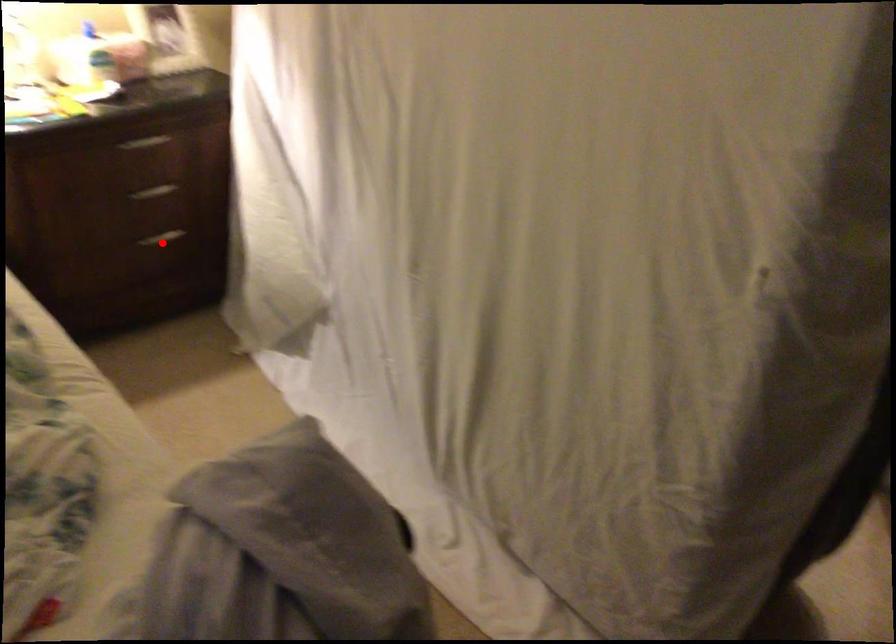
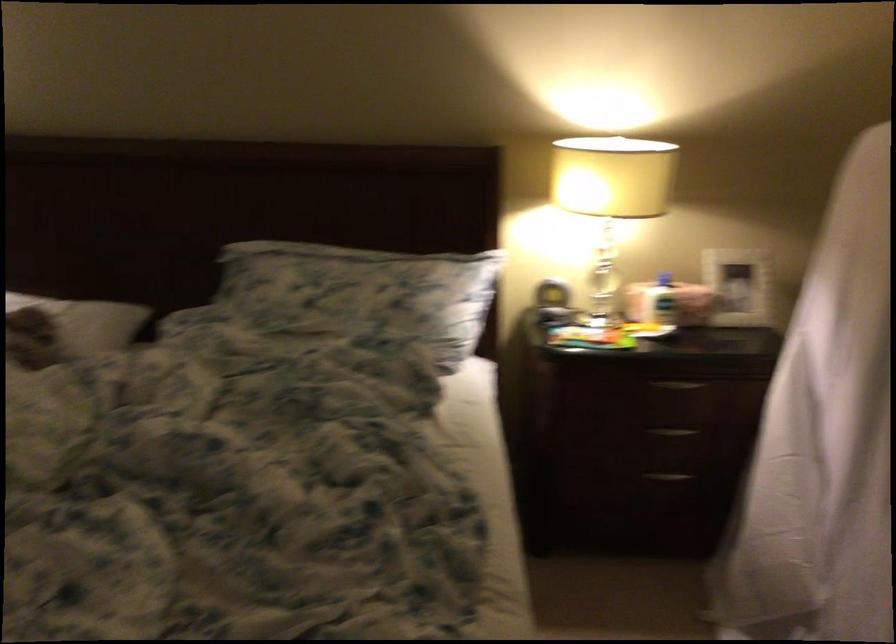
Find the pixel in the second image that matches the highlighted location in the first image.

(668, 476)